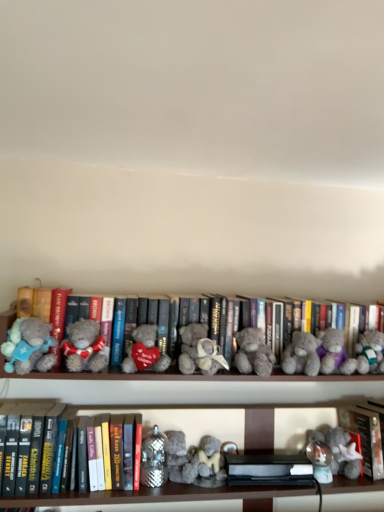
Question: Can you confirm if fluffy gray teddy bear at center, the second teddy bear when ordered from right to left, is taller than fluffy beige teddy bear at right, marked as the 7th teddy bear in a left-to-right arrangement?

Choices:
 (A) no
 (B) yes

Answer: (A)

Question: Is fluffy gray teddy bear at center, the sixth teddy bear when ordered from left to right, facing towards fluffy beige teddy bear at right, which is counted as the 1th teddy bear, starting from the right?

Choices:
 (A) yes
 (B) no

Answer: (B)

Question: Is fluffy gray teddy bear at center, the second teddy bear when ordered from right to left, far from fluffy beige teddy bear at right, marked as the 7th teddy bear in a left-to-right arrangement?

Choices:
 (A) no
 (B) yes

Answer: (A)

Question: Considering the relative sizes of fluffy gray teddy bear at center, the second teddy bear when ordered from right to left, and fluffy beige teddy bear at right, marked as the 7th teddy bear in a left-to-right arrangement, in the image provided, is fluffy gray teddy bear at center, the second teddy bear when ordered from right to left, bigger than fluffy beige teddy bear at right, marked as the 7th teddy bear in a left-to-right arrangement,?

Choices:
 (A) no
 (B) yes

Answer: (A)

Question: Is fluffy gray teddy bear at center, the second teddy bear when ordered from right to left, to the right of fluffy beige teddy bear at right, marked as the 7th teddy bear in a left-to-right arrangement, from the viewer's perspective?

Choices:
 (A) yes
 (B) no

Answer: (B)

Question: Is fluffy gray teddy bear at center, the second teddy bear when ordered from right to left, thinner than fluffy beige teddy bear at right, marked as the 7th teddy bear in a left-to-right arrangement?

Choices:
 (A) no
 (B) yes

Answer: (B)

Question: Is hardcover book at lower left, the third book in the right-to-left sequence, positioned in front of fluffy gray teddy bear at left, acting as the seventh teddy bear starting from the right?

Choices:
 (A) yes
 (B) no

Answer: (B)

Question: Is there a large distance between hardcover book at lower left, the third book in the right-to-left sequence, and fluffy gray teddy bear at left, arranged as the first teddy bear when viewed from the left?

Choices:
 (A) yes
 (B) no

Answer: (B)

Question: Considering the relative positions of hardcover book at lower left, the third book in the right-to-left sequence, and fluffy gray teddy bear at left, arranged as the first teddy bear when viewed from the left, in the image provided, is hardcover book at lower left, the third book in the right-to-left sequence, behind fluffy gray teddy bear at left, arranged as the first teddy bear when viewed from the left,?

Choices:
 (A) no
 (B) yes

Answer: (B)

Question: From the image's perspective, is hardcover book at lower left, the third book in the right-to-left sequence, on top of fluffy gray teddy bear at left, acting as the seventh teddy bear starting from the right?

Choices:
 (A) no
 (B) yes

Answer: (A)

Question: From a real-world perspective, is hardcover book at lower left, the third book in the right-to-left sequence, under fluffy gray teddy bear at left, acting as the seventh teddy bear starting from the right?

Choices:
 (A) yes
 (B) no

Answer: (A)

Question: Does hardcover book at lower left, acting as the 1th book starting from the left, have a lesser width compared to fluffy gray teddy bear at left, arranged as the first teddy bear when viewed from the left?

Choices:
 (A) no
 (B) yes

Answer: (A)

Question: Is fuzzy gray teddy bear at lower right, acting as the second toy starting from the top, to the right of fluffy gray teddy bear at left, the second teddy bear viewed from the left, from the viewer's perspective?

Choices:
 (A) no
 (B) yes

Answer: (B)